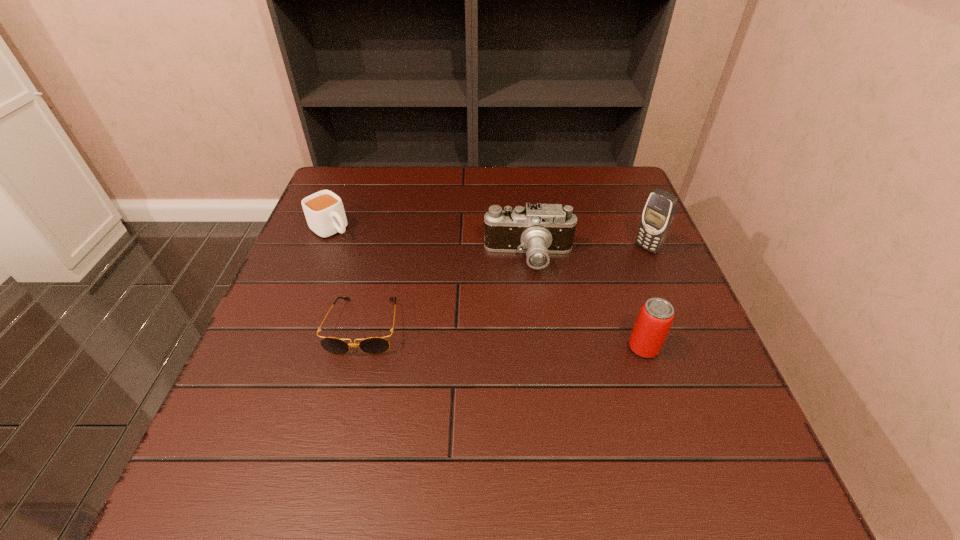
Where is `the second object from left to right`? The height and width of the screenshot is (540, 960). the second object from left to right is located at coordinates [x=374, y=345].

Image resolution: width=960 pixels, height=540 pixels. I want to click on the shortest object, so click(374, 345).

Locate an element on the screen. the fourth object from left to right is located at coordinates (655, 318).

Identify the location of the third object from left to right. (538, 230).

Locate an element on the screen. The image size is (960, 540). cup is located at coordinates (324, 211).

The width and height of the screenshot is (960, 540). What are the coordinates of `the leftmost object` in the screenshot? It's located at (324, 211).

The image size is (960, 540). In order to click on cellular telephone in this screenshot , I will do `click(659, 212)`.

Locate an element on the screen. The image size is (960, 540). the rightmost object is located at coordinates (659, 212).

Locate an element on the screen. The width and height of the screenshot is (960, 540). free space located 0.140m on the lenses of the fourth object from right to left is located at coordinates (341, 421).

The width and height of the screenshot is (960, 540). In order to click on blank area located on the back of the second object from right to left in this screenshot , I will do `click(611, 247)`.